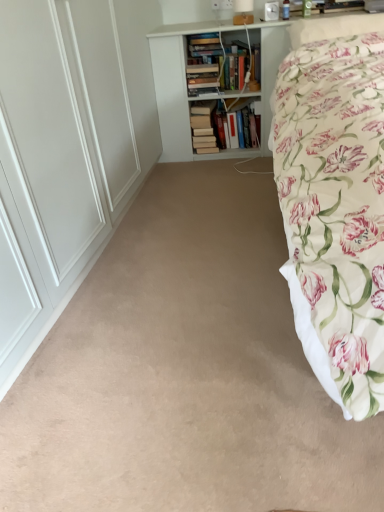
Question: Considering their positions, is beige carpet at center located in front of or behind hardcover books at center?

Choices:
 (A) behind
 (B) front

Answer: (B)

Question: Is beige carpet at center wider or thinner than hardcover books at center?

Choices:
 (A) thin
 (B) wide

Answer: (B)

Question: Which of these objects is positioned closest to the beige carpet at center?

Choices:
 (A) floral fabric pillow at upper right
 (B) hardcover books at center
 (C) floral fabric bed at right
 (D) white wooden bookcase at upper center

Answer: (C)

Question: Which object is the closest to the floral fabric bed at right?

Choices:
 (A) hardcover books at center
 (B) beige carpet at center
 (C) floral fabric pillow at upper right
 (D) white wooden bookcase at upper center

Answer: (C)